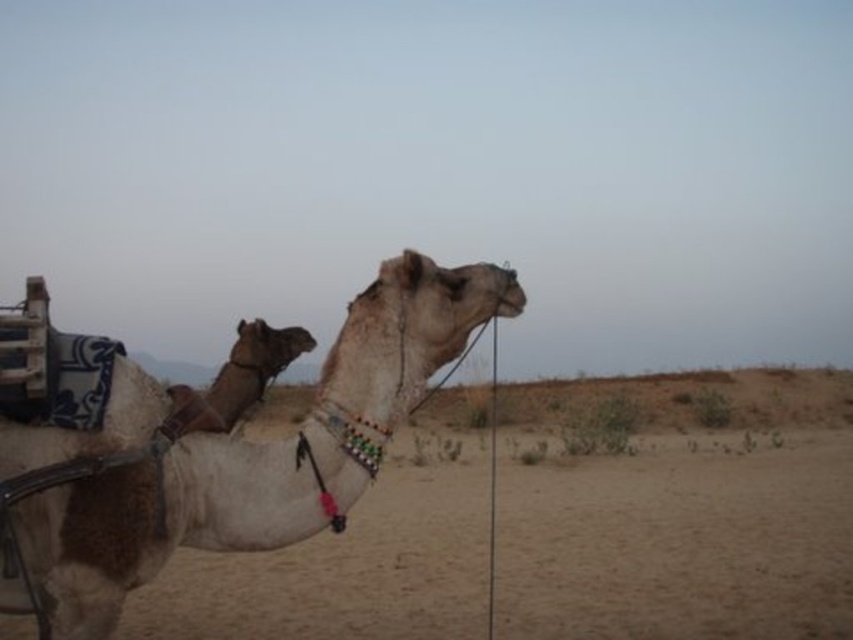
You are a traveler in the desert and need to choose a camel to ride. You have two options in the image. Which camel, the white sand camel at center or the white matte camel at center, would you choose if you want the larger one for comfort?

The white sand camel at center is larger in size than the white matte camel at center, so you should choose the white sand camel at center for better comfort.

You are standing at the origin point in the desert scene. The white sand camel at center is at coordinates approximately 0.825 on the x and 0.803 on the y. If you want to walk directly towards the camel, which direction should you head in? Consider the coordinate system where the origin is the bottom left corner of the image, with x increasing to the right and y increasing upwards.

To reach the white sand camel at center located at coordinates approximately 0.825 on the x and 0.803 on the y, you should head northeast. Since the origin is the bottom left corner, moving right increases the x coordinate and moving up increases the y coordinate. The camel is at a higher x and y than the origin, so northeast direction.

You are a photographer trying to capture both the white sand camel at center and the white matte camel at center in a single frame. Given that your camera has a fixed focal length, which camel will appear wider in the photo?

The white sand camel at center will appear wider in the photo because its width is larger than the white matte camel at center.